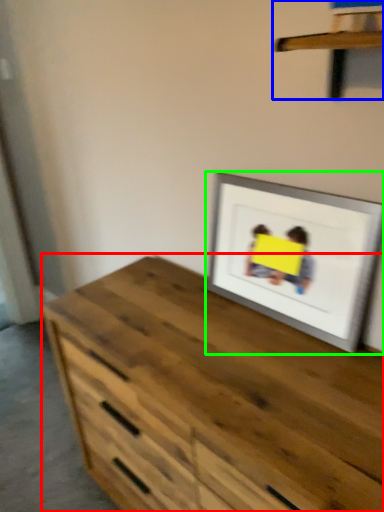
Question: Which is nearer to the chest of drawers (highlighted by a red box)? shelf (highlighted by a blue box) or picture frame (highlighted by a green box).

Choices:
 (A) shelf
 (B) picture frame

Answer: (B)